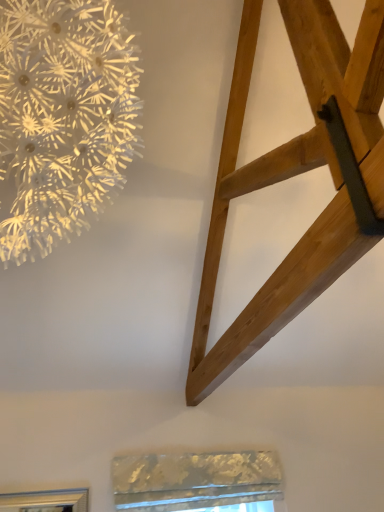
Question: Would you say metallic textured window at lower center is inside or outside white textured paper flower at upper left?

Choices:
 (A) inside
 (B) outside

Answer: (B)

Question: Is metallic textured window at lower center to the left or to the right of white textured paper flower at upper left in the image?

Choices:
 (A) left
 (B) right

Answer: (B)

Question: Estimate the real-world distances between objects in this image. Which object is closer to the white textured paper flower at upper left?

Choices:
 (A) natural wood ladder at upper right
 (B) metallic textured window at lower center

Answer: (A)

Question: Which object is the farthest from the natural wood ladder at upper right?

Choices:
 (A) white textured paper flower at upper left
 (B) metallic textured window at lower center

Answer: (B)